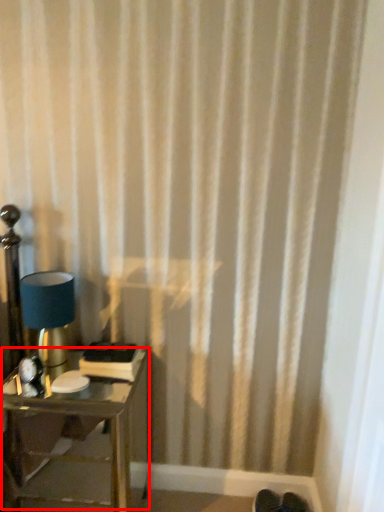
Question: From the image's perspective, where is table (annotated by the red box) located relative to lamp?

Choices:
 (A) below
 (B) above

Answer: (A)